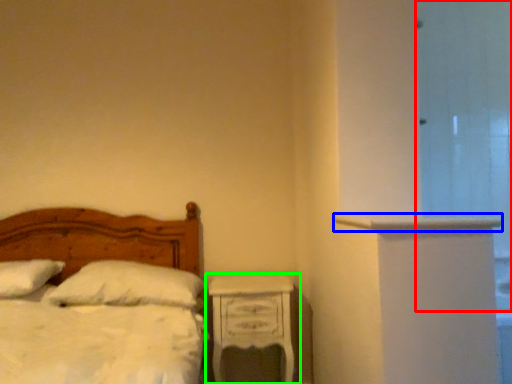
Question: Considering the real-world distances, which object is closest to glass door (highlighted by a red box)? ledge (highlighted by a blue box) or nightstand (highlighted by a green box).

Choices:
 (A) ledge
 (B) nightstand

Answer: (A)